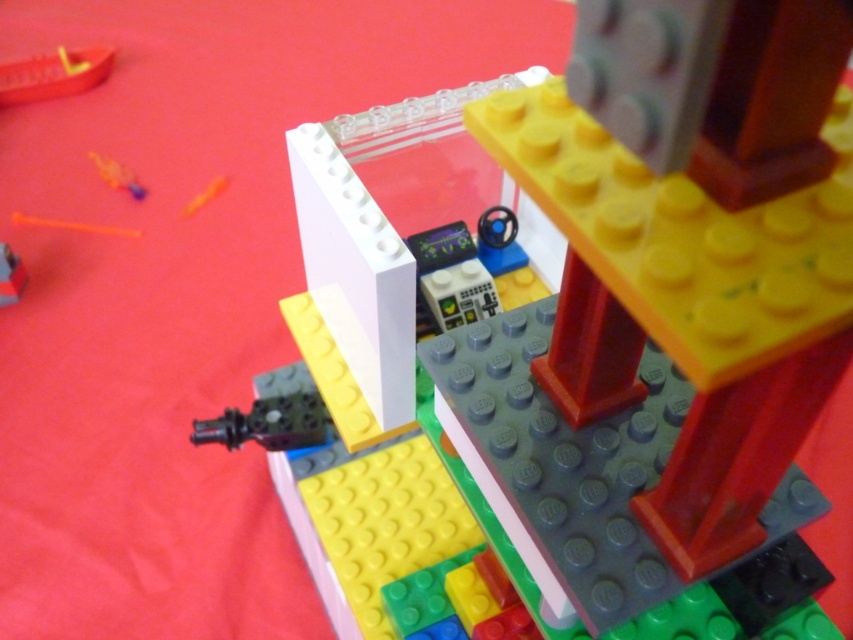
You are organizing a LEGO set and notice two items at the upper left corner of the image. The items are the smooth orange boat at upper left and the translucent plastic toy at upper left. Which item is wider?

The smooth orange boat at upper left is wider than the translucent plastic toy at upper left.

You are examining a LEGO structure and notice two points marked on the image. The first point is at coordinates point (4, 292) and the second is at point (88, 154). From your vantage point, which of these two points appears closer to you?

Point (4, 292) is closer to the camera than point (88, 154), so the first point appears closer to you.